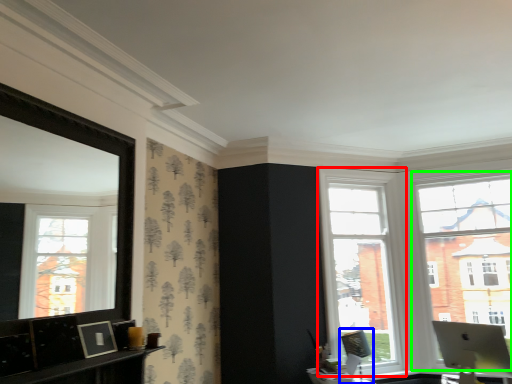
Question: Which is nearer to the window (highlighted by a red box)? swivel chair (highlighted by a blue box) or window (highlighted by a green box).

Choices:
 (A) swivel chair
 (B) window

Answer: (A)